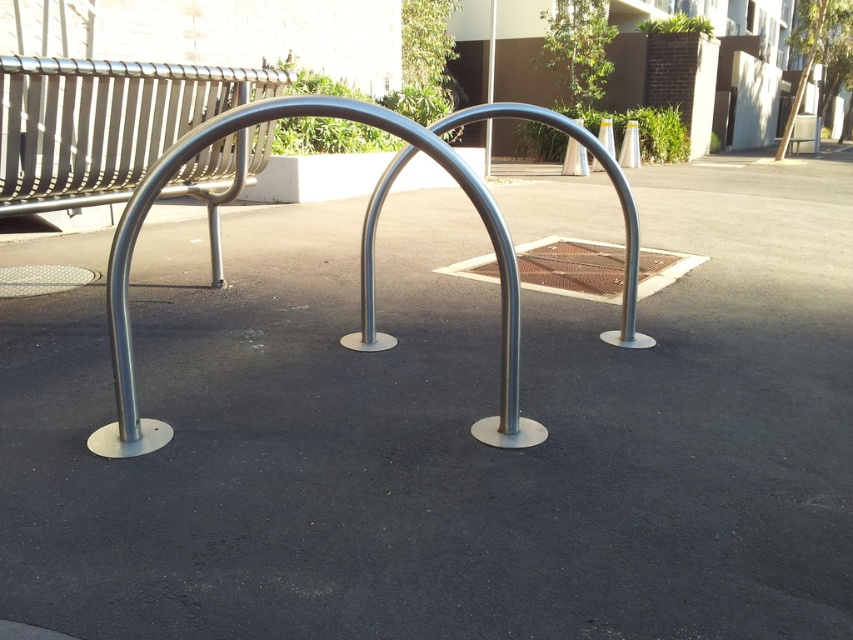
Does point (444, 163) come closer to viewer compared to point (485, 170)?

That is True.

Where is `polished metal bike rack at center`? The image size is (853, 640). polished metal bike rack at center is located at coordinates (361, 256).

Who is more forward, (x=218, y=116) or (x=486, y=164)?

Positioned in front is point (x=218, y=116).

At what (x,y) coordinates should I click in order to perform the action: click on polished metal bike rack at center. Please return your answer as a coordinate pair (x, y). The height and width of the screenshot is (640, 853). Looking at the image, I should click on (361, 256).

Between satin silver bench at upper left and silver metallic pole at center, which one is positioned higher?

silver metallic pole at center is above.

Is satin silver bench at upper left wider than silver metallic pole at center?

Indeed, satin silver bench at upper left has a greater width compared to silver metallic pole at center.

Who is more forward, (218, 88) or (491, 88)?

Point (218, 88) is in front.

Find the location of a particular element. satin silver bench at upper left is located at coordinates (103, 124).

Does point (202, 74) come behind point (509, 419)?

Yes.

Which of these two, satin silver bench at upper left or polished metal bike rack at center, stands shorter?

With less height is satin silver bench at upper left.

Describe the element at coordinates (103, 124) in the screenshot. The width and height of the screenshot is (853, 640). I see `satin silver bench at upper left` at that location.

The width and height of the screenshot is (853, 640). Identify the location of satin silver bench at upper left. (103, 124).